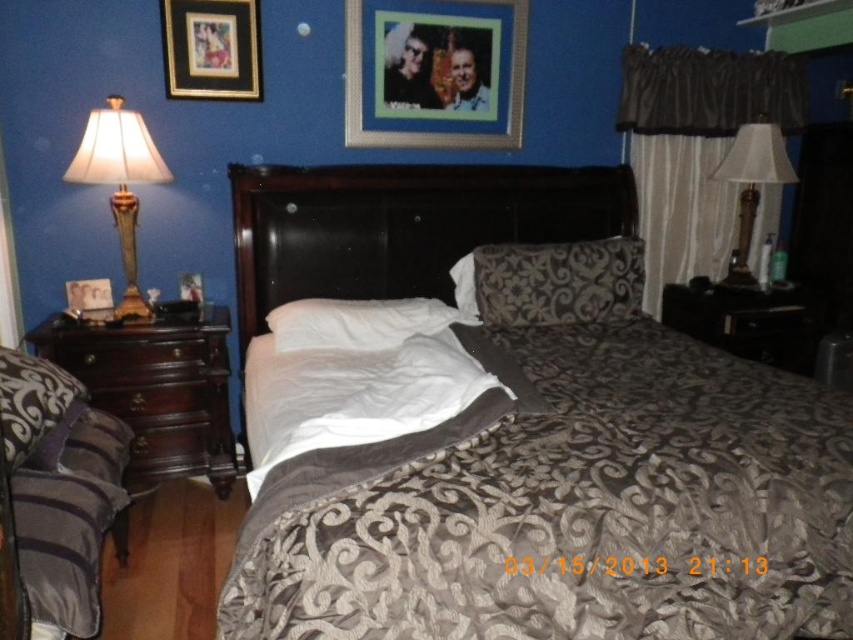
Question: Is dark wood headboard at center thinner than brown damask pillow at center?

Choices:
 (A) yes
 (B) no

Answer: (B)

Question: Which point is closer to the camera?

Choices:
 (A) metallic silver picture frame at upper center
 (B) dark gray textured pillow at lower left
 (C) gold-framed picture at upper left

Answer: (B)

Question: Which object appears farthest from the camera in this image?

Choices:
 (A) white fabric lampshade at right
 (B) matte gold lamp at left

Answer: (A)

Question: Is brown damask pillow at center thinner than white soft pillow at center?

Choices:
 (A) no
 (B) yes

Answer: (B)

Question: Which object is closer to the camera taking this photo?

Choices:
 (A) matte black picture frame at left
 (B) brown wood dresser at left
 (C) dark gray textured pillow at lower left
 (D) brown damask pillow at center

Answer: (C)

Question: Is brown damask pillow at center above gold-framed picture at upper left?

Choices:
 (A) no
 (B) yes

Answer: (A)